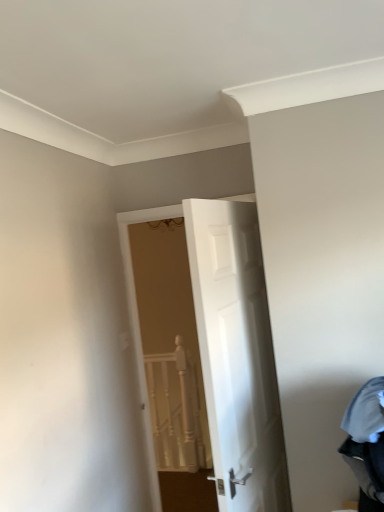
Question: Is denim fabric laundry at lower right completely or partially inside white glossy door at center?

Choices:
 (A) yes
 (B) no

Answer: (B)

Question: Does white glossy door at center come in front of denim fabric laundry at lower right?

Choices:
 (A) yes
 (B) no

Answer: (B)

Question: From the image's perspective, is white glossy door at center beneath denim fabric laundry at lower right?

Choices:
 (A) no
 (B) yes

Answer: (A)

Question: Considering the relative sizes of white glossy door at center and denim fabric laundry at lower right in the image provided, is white glossy door at center taller than denim fabric laundry at lower right?

Choices:
 (A) yes
 (B) no

Answer: (A)

Question: Can you confirm if white glossy door at center is wider than denim fabric laundry at lower right?

Choices:
 (A) no
 (B) yes

Answer: (A)

Question: Could you tell me if white glossy door at center is facing denim fabric laundry at lower right?

Choices:
 (A) yes
 (B) no

Answer: (B)

Question: Is denim fabric laundry at lower right aimed at white textured rail at center?

Choices:
 (A) no
 (B) yes

Answer: (A)

Question: From the image's perspective, does denim fabric laundry at lower right appear higher than white textured rail at center?

Choices:
 (A) yes
 (B) no

Answer: (A)

Question: Is denim fabric laundry at lower right completely or partially outside of white textured rail at center?

Choices:
 (A) no
 (B) yes

Answer: (B)

Question: From the image's perspective, does denim fabric laundry at lower right appear lower than white textured rail at center?

Choices:
 (A) no
 (B) yes

Answer: (A)

Question: Is denim fabric laundry at lower right looking in the opposite direction of white textured rail at center?

Choices:
 (A) no
 (B) yes

Answer: (A)

Question: Is denim fabric laundry at lower right surrounding white textured rail at center?

Choices:
 (A) yes
 (B) no

Answer: (B)

Question: From a real-world perspective, is white glossy door at center over white textured rail at center?

Choices:
 (A) yes
 (B) no

Answer: (A)